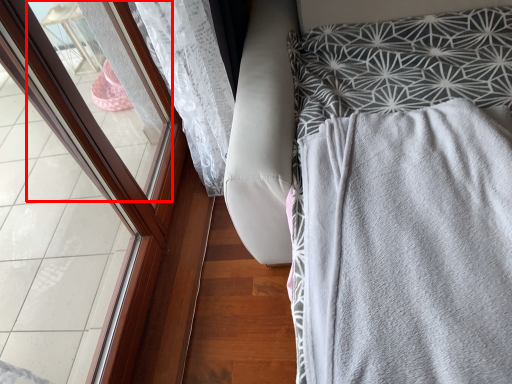
Question: Where is window (annotated by the red box) located in relation to furniture in the image?

Choices:
 (A) right
 (B) left

Answer: (B)